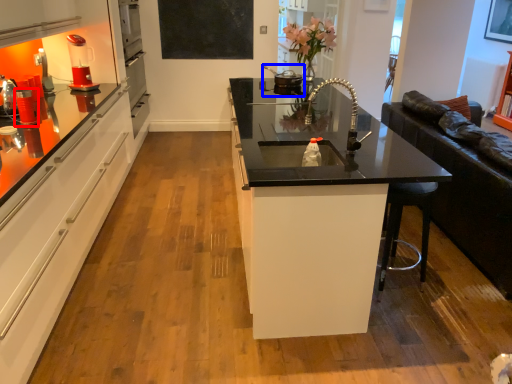
Question: Which of the following is the farthest to the observer, appliance (highlighted by a red box) or appliance (highlighted by a blue box)?

Choices:
 (A) appliance
 (B) appliance

Answer: (B)